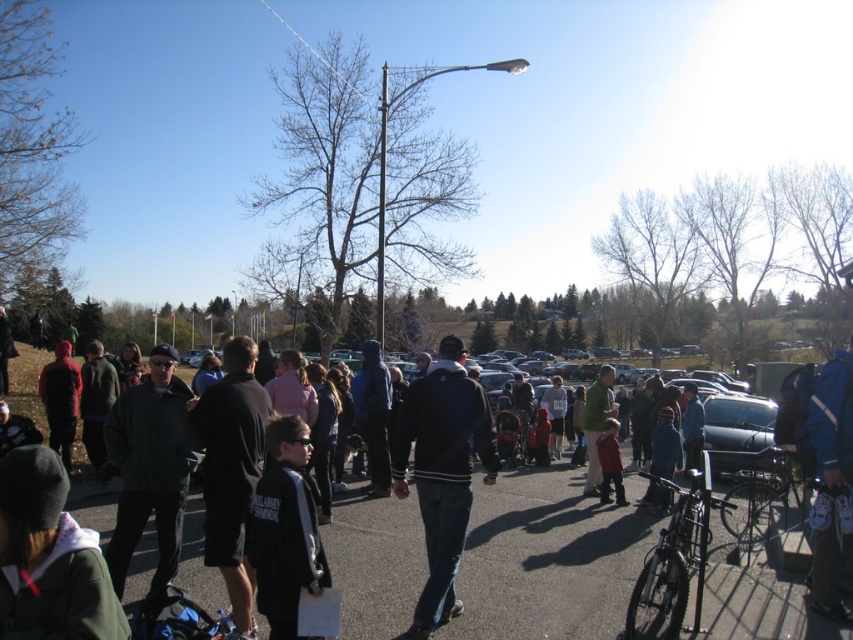
Between point (813, 442) and point (601, 397), which one is positioned behind?

Positioned behind is point (601, 397).

Where is `blue fabric jacket at lower right`? blue fabric jacket at lower right is located at coordinates (831, 483).

Who is lower down, dark green jacket at center or red matte jacket at center?

red matte jacket at center is lower down.

Is dark green jacket at center to the right of red matte jacket at center from the viewer's perspective?

No, dark green jacket at center is not to the right of red matte jacket at center.

Is point (138, 531) less distant than point (614, 472)?

Yes, it is.

What are the coordinates of `dark green jacket at center` in the screenshot? It's located at (149, 467).

Is black cotton jacket at center shorter than shiny metallic bicycle at lower right?

No.

Can you confirm if black cotton jacket at center is positioned to the left of shiny metallic bicycle at lower right?

Correct, you'll find black cotton jacket at center to the left of shiny metallic bicycle at lower right.

Between point (267, 403) and point (724, 513), which one is positioned behind?

The point (724, 513) is more distant.

What are the coordinates of `black cotton jacket at center` in the screenshot? It's located at (231, 472).